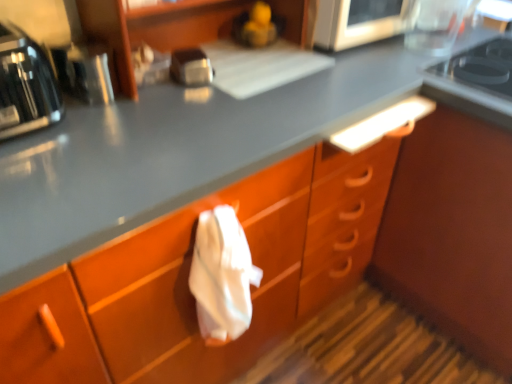
You are a GUI agent. You are given a task and a screenshot of the screen. Output one action in this format:
    pyautogui.click(x=<x>, y=<y>)
    Task: Click on the shiny black toaster at left
    The height and width of the screenshot is (384, 512).
    Given the screenshot: What is the action you would take?
    pyautogui.click(x=25, y=85)

What do you see at coordinates (25, 85) in the screenshot? The width and height of the screenshot is (512, 384). I see `shiny black toaster at left` at bounding box center [25, 85].

The width and height of the screenshot is (512, 384). Describe the element at coordinates (191, 67) in the screenshot. I see `satin silver toaster at upper center` at that location.

Where is `wooden shelf at upper center`? Image resolution: width=512 pixels, height=384 pixels. wooden shelf at upper center is located at coordinates (155, 27).

The width and height of the screenshot is (512, 384). Identify the location of black glass gas stove at upper right. (476, 80).

You are a GUI agent. You are given a task and a screenshot of the screen. Output one action in this format:
    pyautogui.click(x=<x>, y=<y>)
    Task: Click on the shiny black toaster at left
    This screenshot has height=384, width=512.
    Given the screenshot: What is the action you would take?
    pyautogui.click(x=25, y=85)

Which of these two, black glass gas stove at upper right or satin silver toaster at upper center, stands shorter?

Standing shorter between the two is black glass gas stove at upper right.

Is black glass gas stove at upper right next to satin silver toaster at upper center and touching it?

There is a gap between black glass gas stove at upper right and satin silver toaster at upper center.

Is black glass gas stove at upper right smaller than satin silver toaster at upper center?

Incorrect, black glass gas stove at upper right is not smaller in size than satin silver toaster at upper center.

Would you say wooden shelf at upper center is outside shiny black toaster at left?

Yes, wooden shelf at upper center is located beyond the bounds of shiny black toaster at left.

Can you confirm if wooden shelf at upper center is taller than shiny black toaster at left?

Yes.

From the image's perspective, between wooden shelf at upper center and shiny black toaster at left, who is located below?

shiny black toaster at left is shown below in the image.

At what (x,y) coordinates should I click in order to perform the action: click on shelf above the shiny black toaster at left (from a real-world perspective). Please return your answer as a coordinate pair (x, y). The width and height of the screenshot is (512, 384). Looking at the image, I should click on (155, 27).

Does satin silver toaster at upper center have a lesser width compared to metallic silver microwave at upper center, arranged as the first appliance when viewed from the top?

Yes.

Is point (204, 75) behind point (399, 13)?

No, it is not.

Based on their sizes in the image, would you say satin silver toaster at upper center is bigger or smaller than metallic silver microwave at upper center, acting as the first appliance starting from the right?

satin silver toaster at upper center is smaller than metallic silver microwave at upper center, acting as the first appliance starting from the right.

Is satin silver toaster at upper center positioned with its back to metallic silver microwave at upper center, the second appliance positioned from the front?

No, satin silver toaster at upper center is not facing the opposite direction of metallic silver microwave at upper center, the second appliance positioned from the front.

Is satin silver toaster at upper center far away from black glass gas stove at upper right?

satin silver toaster at upper center is near black glass gas stove at upper right, not far away.

Could you tell me if satin silver toaster at upper center is turned towards black glass gas stove at upper right?

No.

In the scene shown: From a real-world perspective, between satin silver toaster at upper center and black glass gas stove at upper right, who is vertically higher?

In real-world perspective, satin silver toaster at upper center is above.

Considering the relative sizes of satin silver toaster at upper center and black glass gas stove at upper right in the image provided, is satin silver toaster at upper center bigger than black glass gas stove at upper right?

Actually, satin silver toaster at upper center might be smaller than black glass gas stove at upper right.

In the scene shown: Are black glass gas stove at upper right and metallic silver microwave at upper center, the second appliance positioned from the front, beside each other?

There is a gap between black glass gas stove at upper right and metallic silver microwave at upper center, the second appliance positioned from the front.

Who is smaller, black glass gas stove at upper right or metallic silver microwave at upper center, placed as the 1th appliance when sorted from back to front?

black glass gas stove at upper right.

Which object is positioned more to the right, black glass gas stove at upper right or metallic silver microwave at upper center, which is counted as the second appliance, starting from the bottom?

From the viewer's perspective, black glass gas stove at upper right appears more on the right side.

Would you say black glass gas stove at upper right is inside or outside metallic silver microwave at upper center, placed as the 2th appliance when sorted from left to right?

The correct answer is: outside.

Considering their positions, is wooden shelf at upper center located in front of or behind metallic silver toaster at left, which is counted as the second appliance, starting from the back?

wooden shelf at upper center is in front of metallic silver toaster at left, which is counted as the second appliance, starting from the back.

Between wooden shelf at upper center and metallic silver toaster at left, which is the first appliance from left to right, which one appears on the left side from the viewer's perspective?

metallic silver toaster at left, which is the first appliance from left to right, is more to the left.

Is wooden shelf at upper center positioned beyond the bounds of metallic silver toaster at left, the 2th appliance from the top?

That's correct, wooden shelf at upper center is outside of metallic silver toaster at left, the 2th appliance from the top.

Is metallic silver toaster at left, which is counted as the second appliance, starting from the back, at the right side of shiny black toaster at left?

Correct, you'll find metallic silver toaster at left, which is counted as the second appliance, starting from the back, to the right of shiny black toaster at left.

From the picture: In terms of height, does metallic silver toaster at left, the 2th appliance from the top, look taller or shorter compared to shiny black toaster at left?

Clearly, metallic silver toaster at left, the 2th appliance from the top, is shorter compared to shiny black toaster at left.

Is metallic silver toaster at left, which is the first appliance from left to right, oriented away from shiny black toaster at left?

metallic silver toaster at left, which is the first appliance from left to right, is not turned away from shiny black toaster at left.

Does metallic silver toaster at left, which is the first appliance from left to right, contain shiny black toaster at left?

No, shiny black toaster at left is located outside of metallic silver toaster at left, which is the first appliance from left to right.

Locate an element on the screen. kitchen appliance below the black glass gas stove at upper right (from the image's perspective) is located at coordinates (191, 67).

I want to click on home appliance below the wooden shelf at upper center (from a real-world perspective), so click(25, 85).

Estimate the real-world distances between objects in this image. Which object is further from metallic silver toaster at left, the first appliance in the front-to-back sequence, shiny black toaster at left or wooden shelf at upper center?

Among the two, wooden shelf at upper center is located further to metallic silver toaster at left, the first appliance in the front-to-back sequence.

Estimate the real-world distances between objects in this image. Which object is closer to satin silver toaster at upper center, metallic silver microwave at upper center, placed as the 1th appliance when sorted from back to front, or wooden shelf at upper center?

Based on the image, wooden shelf at upper center appears to be nearer to satin silver toaster at upper center.

Estimate the real-world distances between objects in this image. Which object is closer to metallic silver microwave at upper center, arranged as the first appliance when viewed from the top, satin silver toaster at upper center or metallic silver toaster at left, which is the first appliance from left to right?

The object closer to metallic silver microwave at upper center, arranged as the first appliance when viewed from the top, is satin silver toaster at upper center.

Looking at the image, which one is located closer to shiny black toaster at left, wooden shelf at upper center or satin silver toaster at upper center?

wooden shelf at upper center is closer to shiny black toaster at left.

Which object lies nearer to the anchor point metallic silver microwave at upper center, arranged as the first appliance when viewed from the top, metallic silver toaster at left, the 2th appliance from the top, or wooden shelf at upper center?

Among the two, wooden shelf at upper center is located nearer to metallic silver microwave at upper center, arranged as the first appliance when viewed from the top.

Which object lies nearer to the anchor point satin silver toaster at upper center, shiny black toaster at left or wooden shelf at upper center?

wooden shelf at upper center lies closer to satin silver toaster at upper center than the other object.

Estimate the real-world distances between objects in this image. Which object is closer to shiny black toaster at left, satin silver toaster at upper center or wooden shelf at upper center?

The object closer to shiny black toaster at left is wooden shelf at upper center.

Looking at the image, which one is located further to metallic silver toaster at left, the first appliance in the front-to-back sequence, wooden shelf at upper center or shiny black toaster at left?

The object further to metallic silver toaster at left, the first appliance in the front-to-back sequence, is wooden shelf at upper center.

Image resolution: width=512 pixels, height=384 pixels. I want to click on shelf between satin silver toaster at upper center and black glass gas stove at upper right, so click(x=155, y=27).

Identify the location of shelf between metallic silver toaster at left, which ranks as the second appliance in right-to-left order, and metallic silver microwave at upper center, placed as the 1th appliance when sorted from back to front. The height and width of the screenshot is (384, 512). (155, 27).

Locate an element on the screen. The height and width of the screenshot is (384, 512). appliance situated between metallic silver toaster at left, the 2th appliance from the top, and black glass gas stove at upper right from left to right is located at coordinates (358, 22).

This screenshot has height=384, width=512. I want to click on shelf between satin silver toaster at upper center and metallic silver microwave at upper center, arranged as the first appliance when viewed from the top, so click(x=155, y=27).